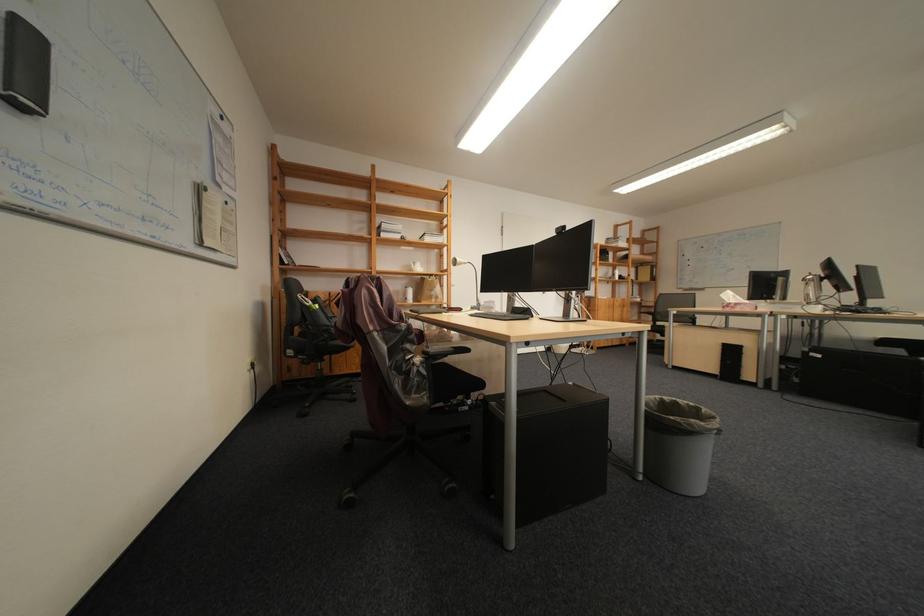
Where is `black computer keyboard`? This screenshot has height=616, width=924. black computer keyboard is located at coordinates (504, 315).